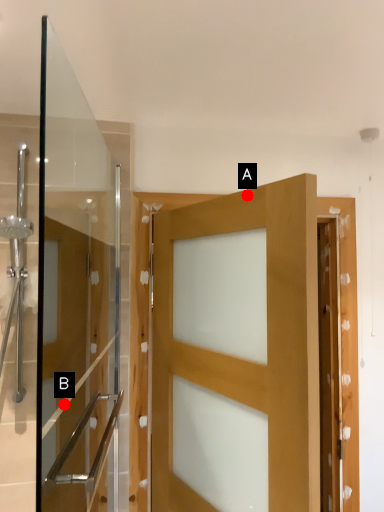
Question: Two points are circled on the image, labeled by A and B beside each circle. Which point is closer to the camera?

Choices:
 (A) A is closer
 (B) B is closer

Answer: (A)